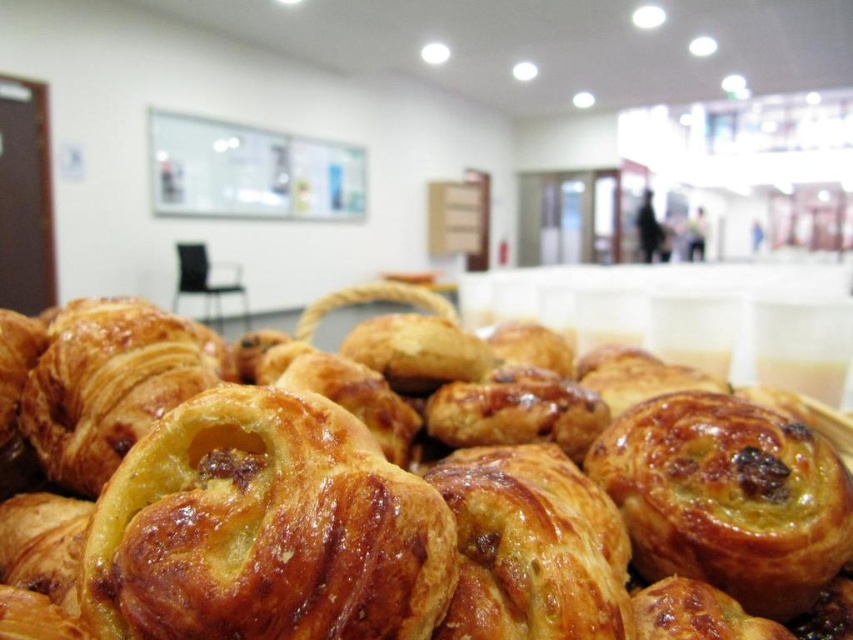
You are a customer in a bakery and want to pick up two pastries located at point (x=837, y=593) and point (x=363, y=502). Which pastry should you grab first to minimize reaching over other pastries?

You should grab the pastry at point (x=837, y=593) first because it is closer to you than the pastry at point (x=363, y=502), so you won